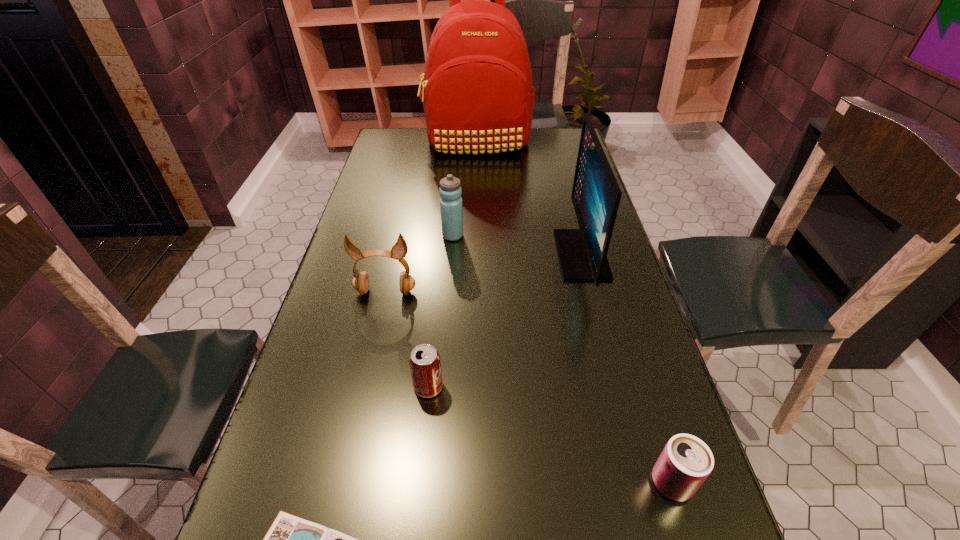
Identify the location of blank area at the far left corner. The image size is (960, 540). (391, 143).

You are a GUI agent. You are given a task and a screenshot of the screen. Output one action in this format:
    pyautogui.click(x=<x>, y=<y>)
    Task: Click on the vacant area that lies between the tallest object and the fifth farthest object
    Image resolution: width=960 pixels, height=540 pixels.
    Given the screenshot: What is the action you would take?
    pyautogui.click(x=452, y=265)

At what (x,y) coordinates should I click in order to perform the action: click on vacant area that lies between the sixth shortest object and the water bottle. Please return your answer as a coordinate pair (x, y). Looking at the image, I should click on (517, 245).

Find the location of a particular element. This screenshot has width=960, height=540. vacant space that is in between the earphone and the water bottle is located at coordinates (420, 264).

Locate an element on the screen. The width and height of the screenshot is (960, 540). vacant point located between the third nearest object and the earphone is located at coordinates (407, 339).

The image size is (960, 540). What are the coordinates of `empty space between the monitor and the third nearest object` in the screenshot? It's located at (505, 321).

The width and height of the screenshot is (960, 540). I want to click on free space between the water bottle and the tallest object, so click(465, 190).

Select which object appears as the second closest to the third nearest object. Please provide its 2D coordinates. Your answer should be formatted as a tuple, i.e. [(x, y)], where the tuple contains the x and y coordinates of a point satisfying the conditions above.

[(360, 282)]

Identify which object is the sixth nearest to the second tallest object. Please provide its 2D coordinates. Your answer should be formatted as a tuple, i.e. [(x, y)], where the tuple contains the x and y coordinates of a point satisfying the conditions above.

[(290, 539)]

What are the coordinates of `vacant position in the image that satisfies the following two spatial constraints: 1. on the front-facing side of the sixth farthest object; 2. on the left side of the earphone` in the screenshot? It's located at (x=344, y=483).